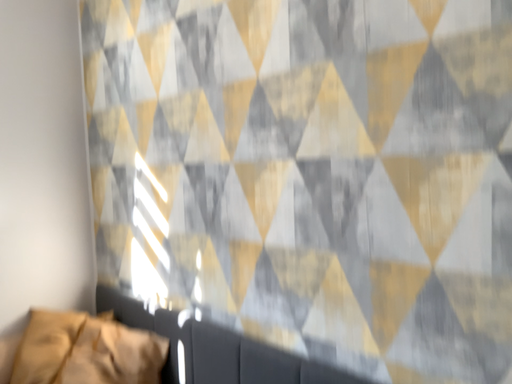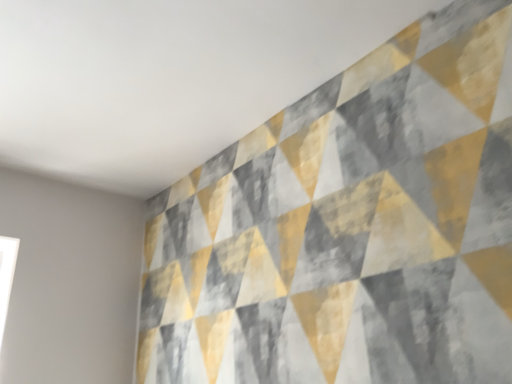
Question: Which way did the camera rotate in the video?

Choices:
 (A) rotated downward
 (B) rotated upward

Answer: (B)